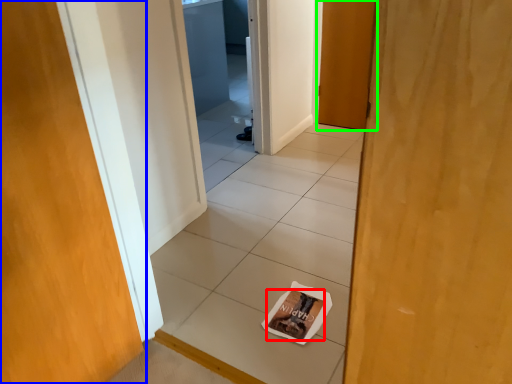
Question: Which is nearer to the magazine (highlighted by a red box)? door (highlighted by a blue box) or door (highlighted by a green box).

Choices:
 (A) door
 (B) door

Answer: (A)